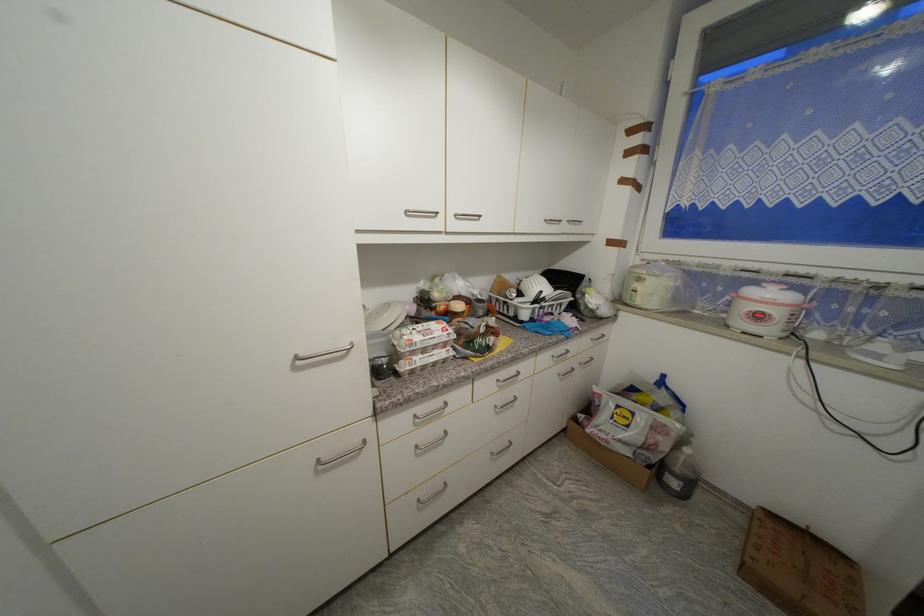
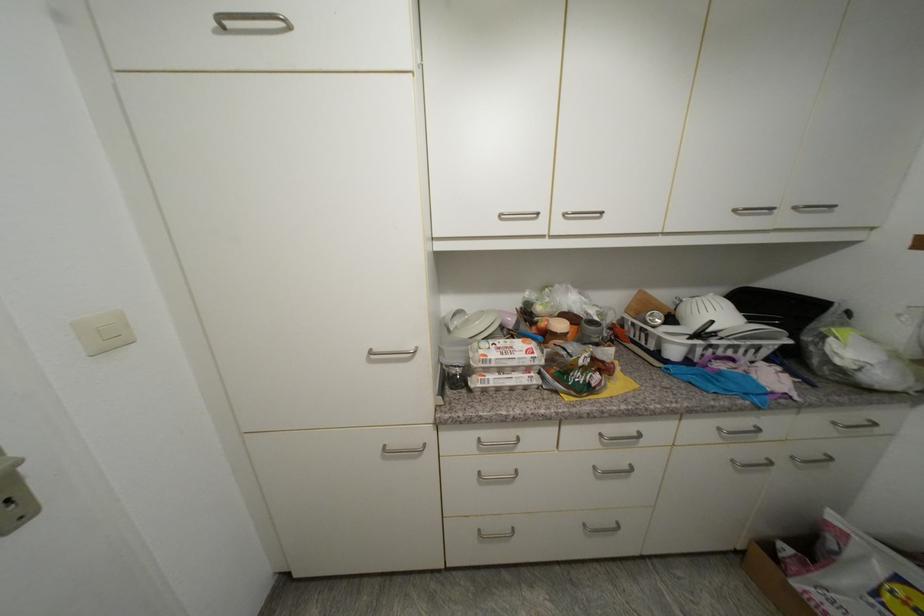
In the second image, find the point that corresponds to pixel 411 213 in the first image.

(505, 217)